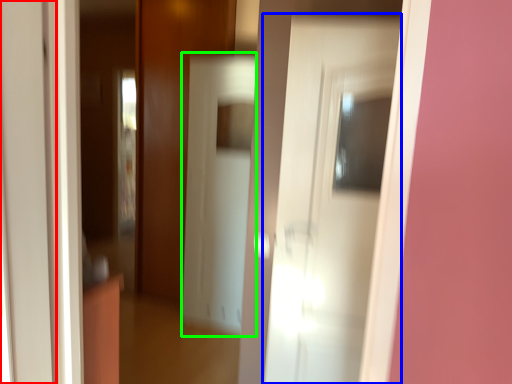
Question: Which object is positioned farthest from door (highlighted by a red box)? Select from door (highlighted by a blue box) and screen door (highlighted by a green box).

Choices:
 (A) door
 (B) screen door

Answer: (B)